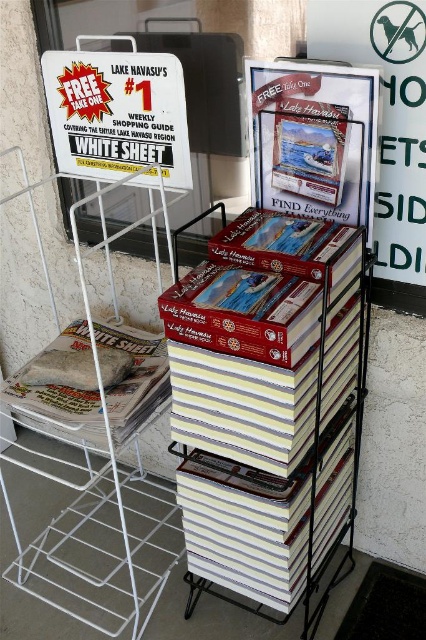
Question: Is white paper sign at upper left bigger than white paper bag at lower left?

Choices:
 (A) yes
 (B) no

Answer: (B)

Question: Which point is farther from the camera taking this photo?

Choices:
 (A) (331, 145)
 (B) (92, 394)

Answer: (B)

Question: Can you confirm if white paper sign at upper left is bigger than white paper bag at lower left?

Choices:
 (A) yes
 (B) no

Answer: (B)

Question: Which point is closer to the camera taking this photo?

Choices:
 (A) (40, 394)
 (B) (298, 364)
 (C) (167, 64)

Answer: (B)

Question: Which object is closer to the camera taking this photo?

Choices:
 (A) white paper bag at lower left
 (B) white glossy book at center

Answer: (B)

Question: In this image, where is white glossy book at center located relative to matte plastic book at center?

Choices:
 (A) below
 (B) above

Answer: (A)